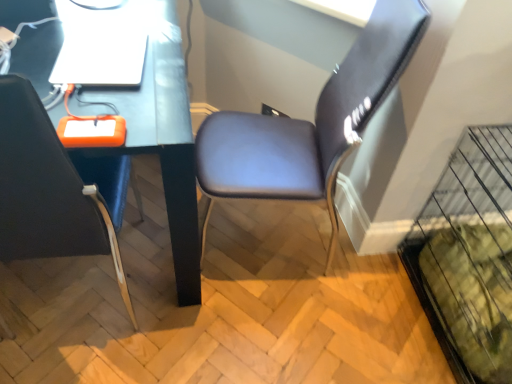
Find the location of a particular element. vacant position to the left of white glossy laptop at upper left is located at coordinates (37, 34).